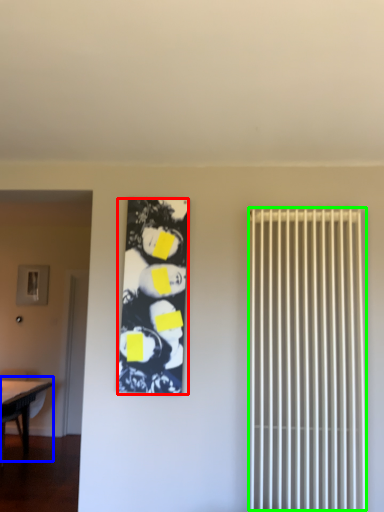
Question: Based on their relative distances, which object is farther from couple (highlighted by a red box)? Choose from table (highlighted by a blue box) and radiator (highlighted by a green box).

Choices:
 (A) table
 (B) radiator

Answer: (A)